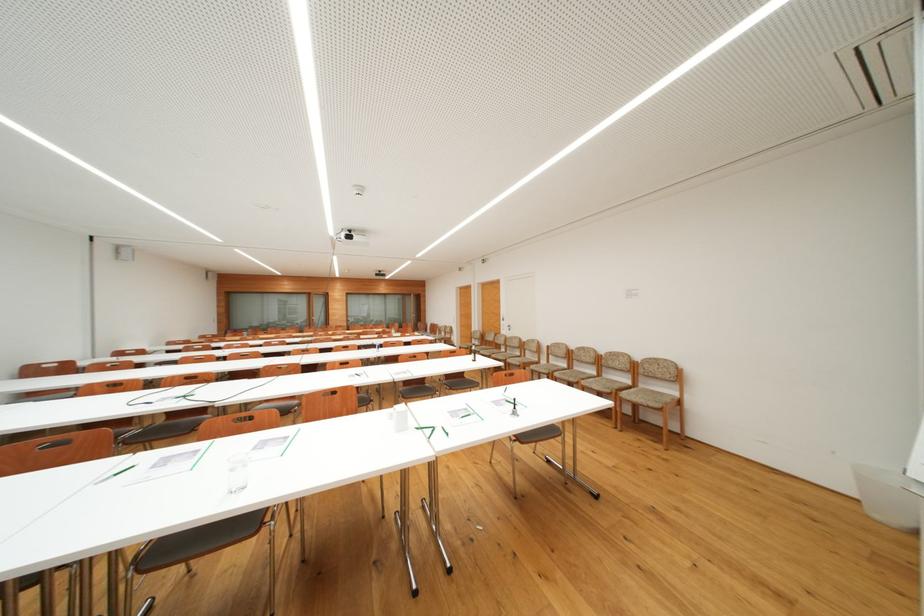
Image resolution: width=924 pixels, height=616 pixels. What do you see at coordinates (298, 241) in the screenshot? I see `the silver door handle` at bounding box center [298, 241].